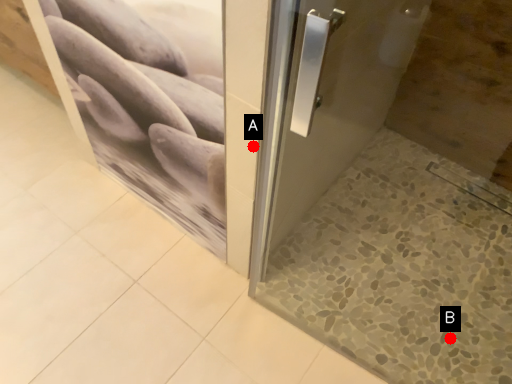
Question: Two points are circled on the image, labeled by A and B beside each circle. Which of the following is the closest to the observer?

Choices:
 (A) A is closer
 (B) B is closer

Answer: (A)